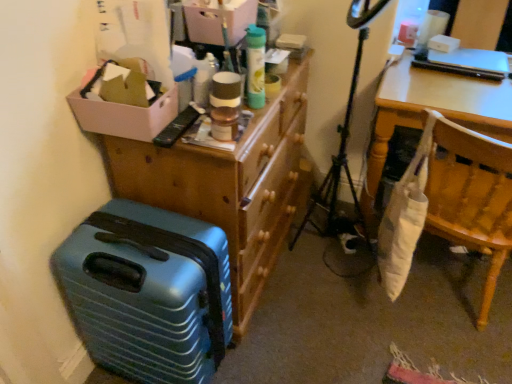
Question: Is white cardboard box at upper left in front of or behind white fabric bag at right in the image?

Choices:
 (A) behind
 (B) front

Answer: (B)

Question: Looking at the image, does white cardboard box at upper left seem bigger or smaller compared to white fabric bag at right?

Choices:
 (A) big
 (B) small

Answer: (B)

Question: Estimate the real-world distances between objects in this image. Which object is farther from the wooden dresser at upper center?

Choices:
 (A) white fabric bag at right
 (B) teal matte suitcase at lower left
 (C) white cardboard box at upper left
 (D) matte cardboard box at upper center

Answer: (A)

Question: Which is farther from the white cardboard box at upper left?

Choices:
 (A) matte cardboard box at upper center
 (B) teal matte suitcase at lower left
 (C) wooden dresser at upper center
 (D) white fabric bag at right

Answer: (D)